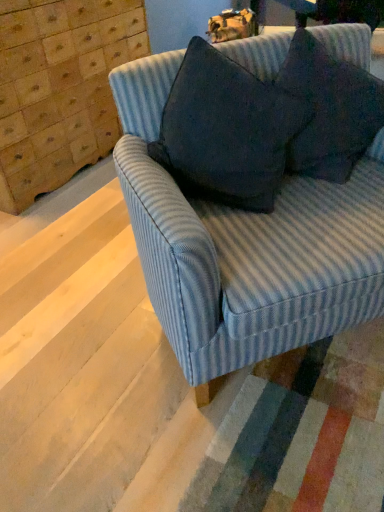
Question: From a real-world perspective, is dark gray fabric pillow at upper right, arranged as the second throw pillow when viewed from the right, physically located above or below dark fabric pillow at upper right, which is counted as the second throw pillow, starting from the left?

Choices:
 (A) above
 (B) below

Answer: (A)

Question: In the image, is dark gray fabric pillow at upper right, the first throw pillow when ordered from left to right, positioned in front of or behind dark fabric pillow at upper right, which is counted as the second throw pillow, starting from the left?

Choices:
 (A) behind
 (B) front

Answer: (B)

Question: Which object is the farthest from the wooden dresser at upper left?

Choices:
 (A) blue striped fabric couch at center
 (B) dark gray fabric pillow at upper right, arranged as the second throw pillow when viewed from the right
 (C) dark fabric pillow at upper right, which is counted as the 1th throw pillow, starting from the right

Answer: (C)

Question: Which is farther from the wooden dresser at upper left?

Choices:
 (A) dark fabric pillow at upper right, which is counted as the second throw pillow, starting from the left
 (B) dark gray fabric pillow at upper right, arranged as the second throw pillow when viewed from the right
 (C) blue striped fabric couch at center

Answer: (A)